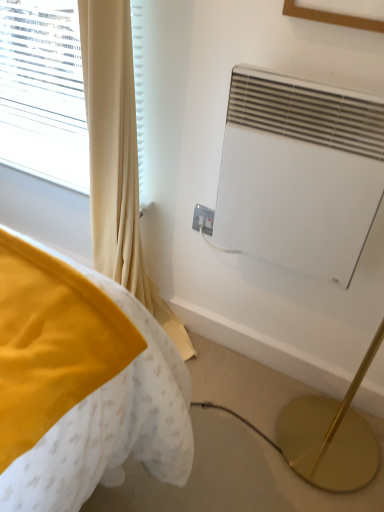
This screenshot has width=384, height=512. What do you see at coordinates (299, 173) in the screenshot? I see `white matte air conditioner at upper right` at bounding box center [299, 173].

Identify the location of beige fabric curtain at left. (117, 157).

What do you see at coordinates (332, 17) in the screenshot? This screenshot has height=512, width=384. I see `wooden picture frame at upper center` at bounding box center [332, 17].

Where is `wooden picture frame at upper center`? wooden picture frame at upper center is located at coordinates (332, 17).

At what (x,y) coordinates should I click in order to perform the action: click on white matte air conditioner at upper right. Please return your answer as a coordinate pair (x, y). This screenshot has height=512, width=384. Looking at the image, I should click on pyautogui.click(x=299, y=173).

Which is closer, (303, 15) or (96, 191)?

Positioned in front is point (303, 15).

Is wooden picture frame at upper center not within beige fabric curtain at left?

wooden picture frame at upper center is positioned outside beige fabric curtain at left.

You are a GUI agent. You are given a task and a screenshot of the screen. Output one action in this format:
    pyautogui.click(x=<x>, y=<y>)
    Task: Click on the picture frame in front of the beige fabric curtain at left
    Image resolution: width=384 pixels, height=512 pixels.
    Given the screenshot: What is the action you would take?
    pyautogui.click(x=332, y=17)

Between wooden picture frame at upper center and beige fabric curtain at left, which one has more height?

beige fabric curtain at left is taller.

At what (x,y) coordinates should I click in order to perform the action: click on electric outlet directly beneath the wooden picture frame at upper center (from a real-world perspective). Please return your answer as a coordinate pair (x, y). Looking at the image, I should click on (203, 219).

Considering the points (201, 212) and (347, 24), which point is behind, point (201, 212) or point (347, 24)?

The point (201, 212) is behind.

Is white plastic electric outlet at center spatially inside wooden picture frame at upper center, or outside of it?

The correct answer is: outside.

Does point (257, 97) come in front of point (204, 211)?

Yes, it is.

Is white matte air conditioner at upper right wider or thinner than white plastic electric outlet at center?

In the image, white matte air conditioner at upper right appears to be wider than white plastic electric outlet at center.

From the image's perspective, which is below, white matte air conditioner at upper right or white plastic electric outlet at center?

white plastic electric outlet at center is shown below in the image.

In the scene shown: Are white matte air conditioner at upper right and white plastic electric outlet at center making contact?

No, white matte air conditioner at upper right is not beside white plastic electric outlet at center.

Is white plastic electric outlet at center not near beige fabric curtain at left?

That's not correct — white plastic electric outlet at center is a little close to beige fabric curtain at left.

Consider the image. Between white plastic electric outlet at center and beige fabric curtain at left, which one is positioned in front?

Positioned in front is beige fabric curtain at left.

Who is shorter, white plastic electric outlet at center or beige fabric curtain at left?

With less height is white plastic electric outlet at center.

Is point (201, 227) closer to viewer compared to point (120, 94)?

No, it is not.

Between white matte air conditioner at upper right and wooden picture frame at upper center, which one is positioned in front?

wooden picture frame at upper center is in front.

Find the location of a particular element. The width and height of the screenshot is (384, 512). air conditioning below the wooden picture frame at upper center (from a real-world perspective) is located at coordinates (299, 173).

Between white matte air conditioner at upper right and wooden picture frame at upper center, which one has more height?

white matte air conditioner at upper right.

Is white matte air conditioner at upper right inside or outside of wooden picture frame at upper center?

white matte air conditioner at upper right is not inside wooden picture frame at upper center, it's outside.

Is white matte air conditioner at upper right at the back of wooden picture frame at upper center?

No.

You are a GUI agent. You are given a task and a screenshot of the screen. Output one action in this format:
    pyautogui.click(x=<x>, y=<y>)
    Task: Click on the picture frame in front of the white matte air conditioner at upper right
    The image size is (384, 512).
    Given the screenshot: What is the action you would take?
    pyautogui.click(x=332, y=17)

Considering the relative positions of wooden picture frame at upper center and white matte air conditioner at upper right in the image provided, is wooden picture frame at upper center to the left of white matte air conditioner at upper right from the viewer's perspective?

Incorrect, wooden picture frame at upper center is not on the left side of white matte air conditioner at upper right.

Which object is thinner, white matte air conditioner at upper right or beige fabric curtain at left?

With smaller width is white matte air conditioner at upper right.

From the image's perspective, is white matte air conditioner at upper right above beige fabric curtain at left?

Incorrect, from the image's perspective, white matte air conditioner at upper right is lower than beige fabric curtain at left.

Is white matte air conditioner at upper right placed right next to beige fabric curtain at left?

No, white matte air conditioner at upper right is not making contact with beige fabric curtain at left.

From a real-world perspective, relative to beige fabric curtain at left, is white matte air conditioner at upper right vertically above or below?

In terms of real-world spatial position, white matte air conditioner at upper right is above beige fabric curtain at left.

Find the location of `curtain located behind the wooden picture frame at upper center`. curtain located behind the wooden picture frame at upper center is located at coordinates (117, 157).

Locate an element on the screen. This screenshot has width=384, height=512. picture frame in front of the white plastic electric outlet at center is located at coordinates (332, 17).

Which object lies further to the anchor point beige fabric curtain at left, wooden picture frame at upper center or white matte air conditioner at upper right?

The object further to beige fabric curtain at left is wooden picture frame at upper center.

When comparing their distances from white plastic electric outlet at center, does beige fabric curtain at left or wooden picture frame at upper center seem further?

Based on the image, wooden picture frame at upper center appears to be further to white plastic electric outlet at center.

When comparing their distances from white plastic electric outlet at center, does white matte air conditioner at upper right or beige fabric curtain at left seem closer?

The object closer to white plastic electric outlet at center is beige fabric curtain at left.

Which object lies nearer to the anchor point white plastic electric outlet at center, wooden picture frame at upper center or beige fabric curtain at left?

beige fabric curtain at left lies closer to white plastic electric outlet at center than the other object.

When comparing their distances from beige fabric curtain at left, does white matte air conditioner at upper right or white plastic electric outlet at center seem further?

white matte air conditioner at upper right is positioned further to the anchor beige fabric curtain at left.

Considering their positions, is beige fabric curtain at left positioned closer to wooden picture frame at upper center than white plastic electric outlet at center?

white plastic electric outlet at center lies closer to wooden picture frame at upper center than the other object.

Considering their positions, is wooden picture frame at upper center positioned further to beige fabric curtain at left than white plastic electric outlet at center?

wooden picture frame at upper center lies further to beige fabric curtain at left than the other object.

Based on their spatial positions, is beige fabric curtain at left or white matte air conditioner at upper right closer to wooden picture frame at upper center?

The object closer to wooden picture frame at upper center is white matte air conditioner at upper right.

At what (x,y) coordinates should I click in order to perform the action: click on air conditioning between wooden picture frame at upper center and white plastic electric outlet at center in the front-back direction. Please return your answer as a coordinate pair (x, y). The height and width of the screenshot is (512, 384). Looking at the image, I should click on (299, 173).

Image resolution: width=384 pixels, height=512 pixels. I want to click on curtain between wooden picture frame at upper center and white plastic electric outlet at center from front to back, so click(x=117, y=157).

Locate an element on the screen. The image size is (384, 512). air conditioning located between beige fabric curtain at left and white plastic electric outlet at center in the depth direction is located at coordinates (299, 173).

Locate an element on the screen. This screenshot has width=384, height=512. air conditioning situated between beige fabric curtain at left and wooden picture frame at upper center from left to right is located at coordinates (299, 173).